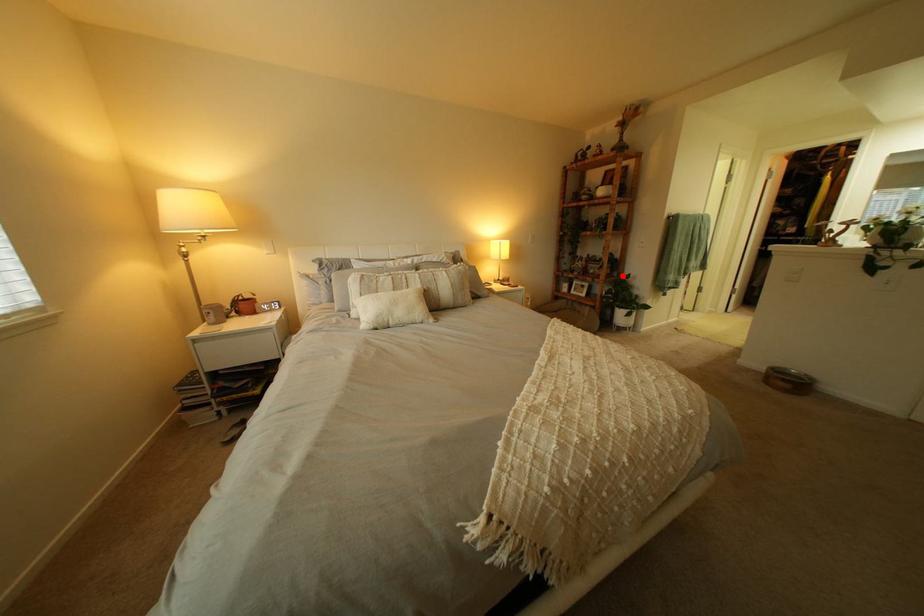
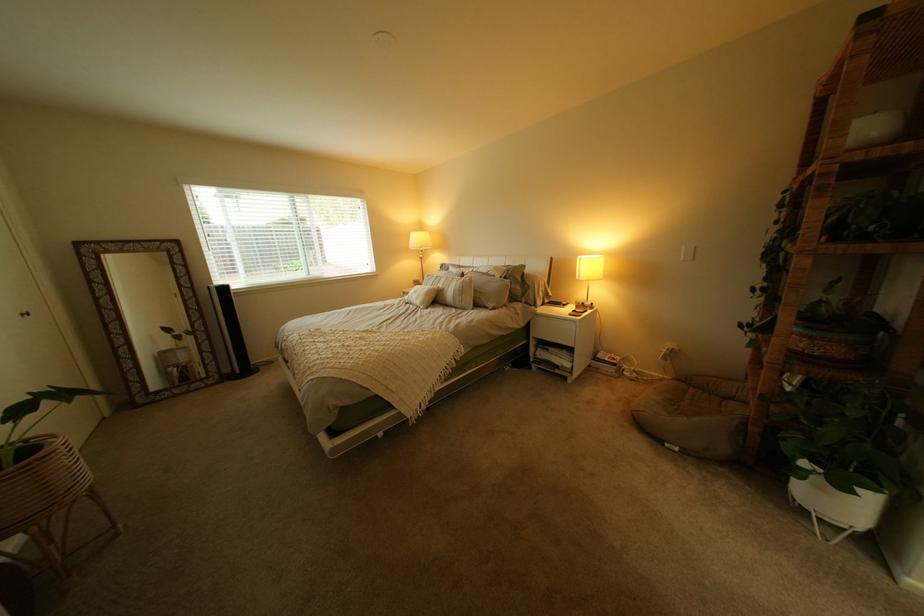
In the second image, find the point that corresponds to the highlighted location in the first image.

(805, 354)